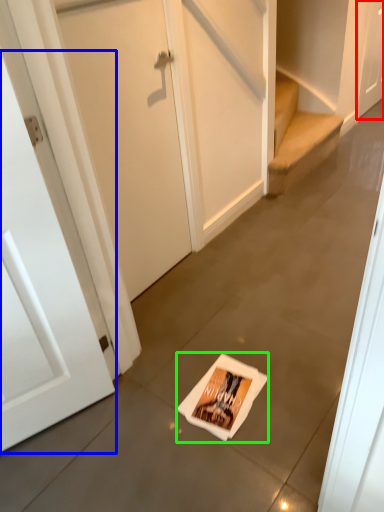
Question: Estimate the real-world distances between objects in this image. Which object is closer to door (highlighted by a red box), door (highlighted by a blue box) or flyer (highlighted by a green box)?

Choices:
 (A) door
 (B) flyer

Answer: (B)